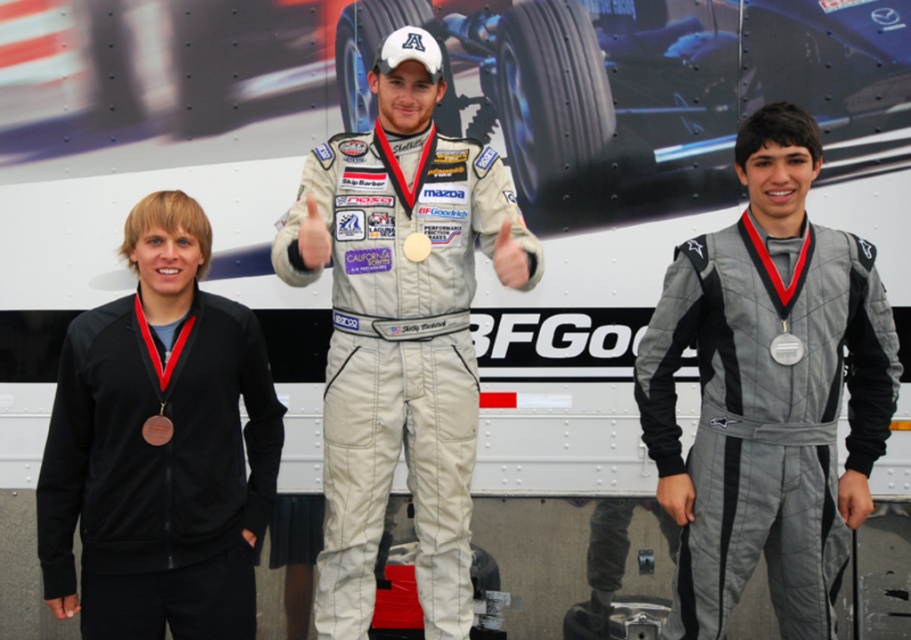
Question: Which of the following is the closest to the observer?

Choices:
 (A) silver metallic medal at center
 (B) black fabric jacket at left
 (C) quilted gray jumpsuit at center
 (D) gold metallic medal at center

Answer: (D)

Question: Which of the following is the farthest from the observer?

Choices:
 (A) matte white racing suit at center
 (B) silver metallic medal at center
 (C) black fabric jacket at left
 (D) gold metallic medal at center

Answer: (B)

Question: Where is quilted gray jumpsuit at center located in relation to black fabric jacket at left in the image?

Choices:
 (A) right
 (B) left

Answer: (A)

Question: Does quilted gray jumpsuit at center appear on the left side of matte white racing suit at center?

Choices:
 (A) no
 (B) yes

Answer: (A)

Question: Is black fabric jacket at left closer to camera compared to silver metallic medal at center?

Choices:
 (A) yes
 (B) no

Answer: (A)

Question: Considering the real-world distances, which object is farthest from the quilted gray jumpsuit at center?

Choices:
 (A) matte white racing suit at center
 (B) gold metallic medal at center

Answer: (B)